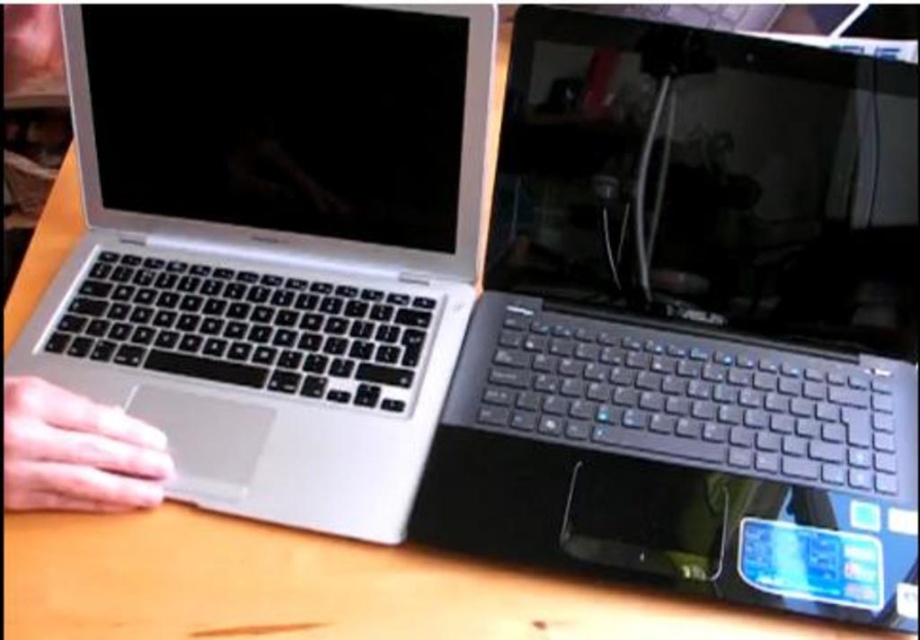
Measure the distance from satin black laptop at center to skinny white hand at lower left.

15.21 inches

Is point (723, 484) in front of point (14, 392)?

No, it is not.

Where is `satin black laptop at center`? The height and width of the screenshot is (640, 920). satin black laptop at center is located at coordinates (693, 323).

Does point (713, 419) come farther from viewer compared to point (238, 186)?

No.

Does point (589, 163) come in front of point (359, 122)?

No.

This screenshot has height=640, width=920. In order to click on satin black laptop at center in this screenshot , I will do `click(693, 323)`.

Can you confirm if sleek silver laptop at left is positioned above skinny white hand at lower left?

Yes, sleek silver laptop at left is above skinny white hand at lower left.

The height and width of the screenshot is (640, 920). What are the coordinates of `sleek silver laptop at left` in the screenshot? It's located at (273, 244).